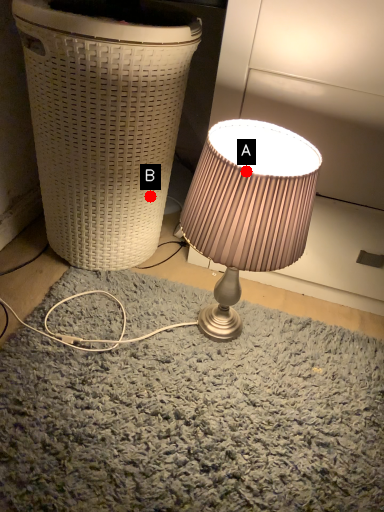
Question: Two points are circled on the image, labeled by A and B beside each circle. Which point is closer to the camera?

Choices:
 (A) A is closer
 (B) B is closer

Answer: (A)